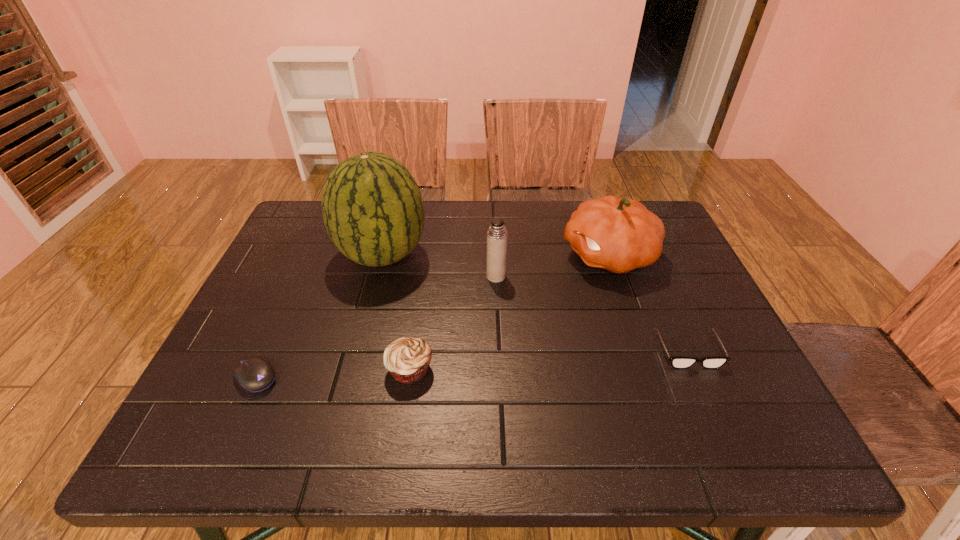
At what (x,y) coordinates should I click in order to perform the action: click on vacant space at the far edge of the desktop. Please return your answer as a coordinate pair (x, y). Looking at the image, I should click on click(x=545, y=211).

Identify the location of vacant space at the near edge. (644, 433).

The height and width of the screenshot is (540, 960). What are the coordinates of `free region at the left edge of the desktop` in the screenshot? It's located at (230, 347).

In the image, there is a desktop. At what (x,y) coordinates should I click in order to perform the action: click on vacant space at the right edge. Please return your answer as a coordinate pair (x, y). Looking at the image, I should click on (756, 410).

In the image, there is a desktop. At what (x,y) coordinates should I click in order to perform the action: click on vacant space at the near right corner. Please return your answer as a coordinate pair (x, y). This screenshot has width=960, height=540. Looking at the image, I should click on (712, 430).

Find the location of `unoccupied position between the watermelon and the spectacles`. unoccupied position between the watermelon and the spectacles is located at coordinates (535, 302).

Identify the location of free space between the fourth tallest object and the pumpkin. Image resolution: width=960 pixels, height=540 pixels. (509, 312).

Where is `free spot between the watermelon and the fourth tallest object`? The height and width of the screenshot is (540, 960). free spot between the watermelon and the fourth tallest object is located at coordinates (396, 312).

Find the location of a particular element. The image size is (960, 540). free spot between the spectacles and the thermos bottle is located at coordinates (592, 313).

Locate an element on the screen. The image size is (960, 540). empty location between the thermos bottle and the spectacles is located at coordinates (592, 313).